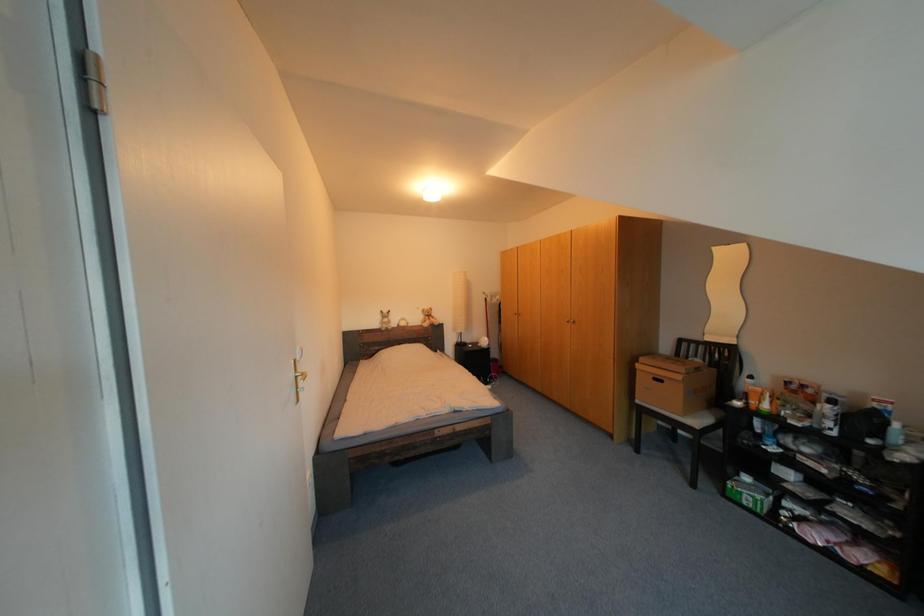
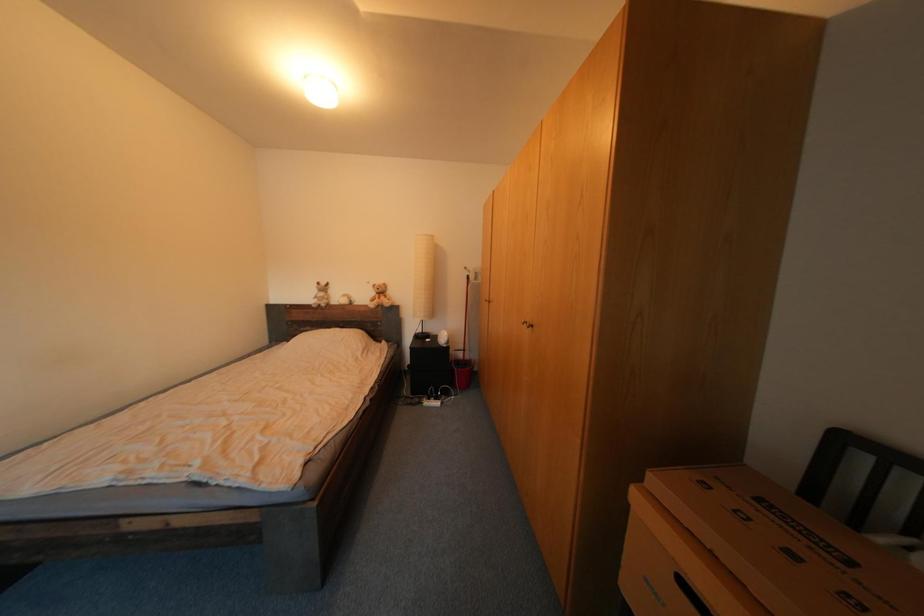
Which direction would the cameraman need to move to produce the second image?

The cameraman walked toward right, forward.